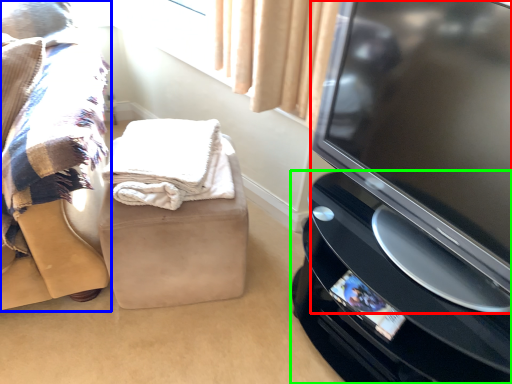
Question: Based on their relative distances, which object is nearer to television (highlighted by a red box)? Choose from furniture (highlighted by a blue box) and home appliance (highlighted by a green box).

Choices:
 (A) furniture
 (B) home appliance

Answer: (B)